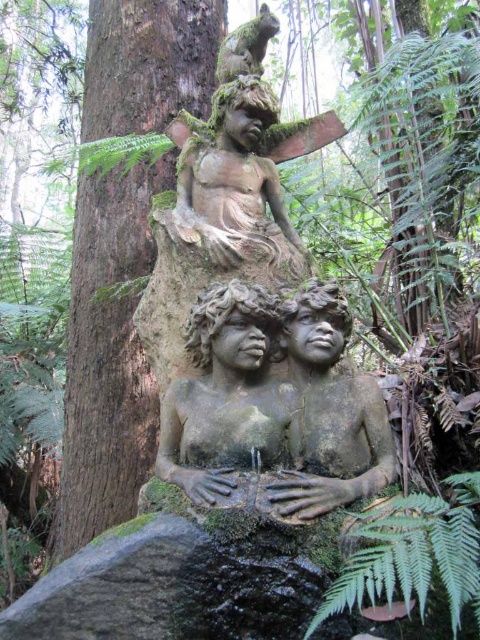
You are a photographer planning to take a picture of the stone textured statue at center. You need to position your camera exactly at point (228, 396). Can you confirm if this point is on the statue?

Yes, the point (228, 396) is on the stone textured statue at center as per the coordinates provided.

You are an art conservator assessing the placement of two stone statues in a forest. You notice the stone textured statue at center and the stone statue at upper center. Based on their sizes, which statue would require a more stable base to prevent toppling?

The stone statue at upper center is larger than the stone textured statue at center, so it would require a more stable base to prevent toppling due to its greater size and potential weight.

You are an art conservator assessing the placement of the stone textured statue at center and the stone statue at upper center in the forest scene. Given that the path between them is only 1 meter wide, can both statues be positioned side by side without overlapping?

The stone textured statue at center is narrower than the stone statue at upper center. However, since the path between them is only 1 meter wide and we don not have exact measurements of their widths, it is uncertain if they can fit side by side without overlapping. Further information on their individual widths is needed to determine feasibility.